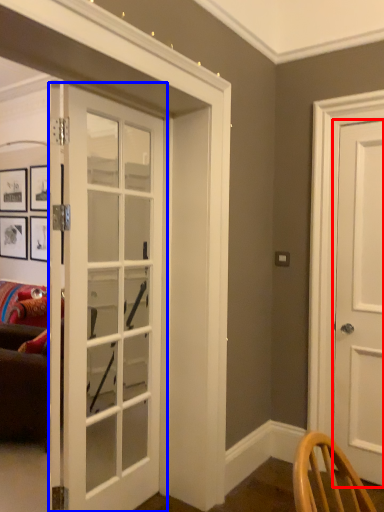
Question: Which of the following is the farthest to the observer, door (highlighted by a red box) or door (highlighted by a blue box)?

Choices:
 (A) door
 (B) door

Answer: (A)